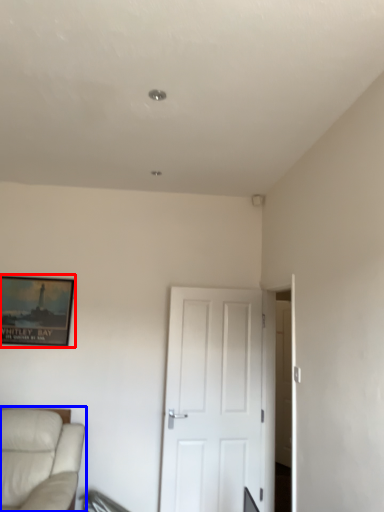
Question: Which of the following is the closest to the observer, picture frame (highlighted by a red box) or studio couch (highlighted by a blue box)?

Choices:
 (A) picture frame
 (B) studio couch

Answer: (B)